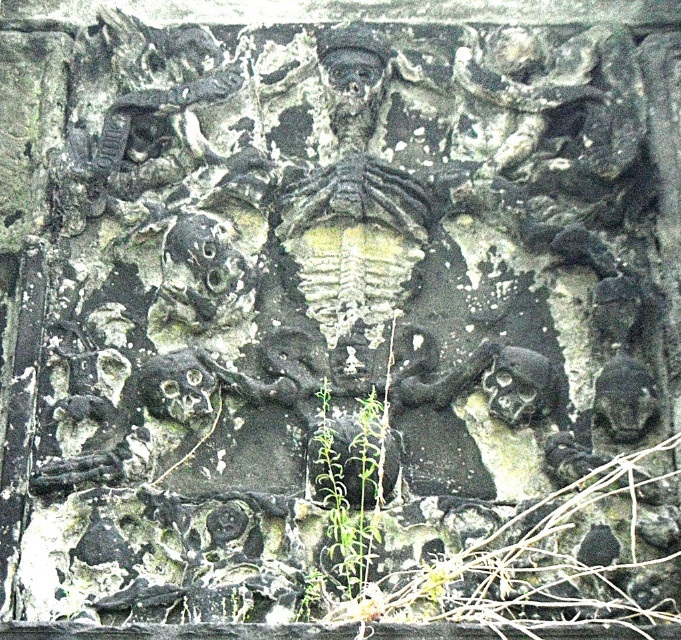
Question: Is green leafy plant at center smaller than dark gray stone skull at lower right?

Choices:
 (A) yes
 (B) no

Answer: (A)

Question: Which object is closer to the camera taking this photo?

Choices:
 (A) green leafy plant at center
 (B) dark gray stone skull at lower right

Answer: (A)

Question: Among these objects, which one is farthest from the camera?

Choices:
 (A) dark gray stone skull at lower right
 (B) green leafy plant at center

Answer: (A)

Question: Does green leafy plant at center appear over dark gray stone skull at lower right?

Choices:
 (A) yes
 (B) no

Answer: (B)

Question: From the image, what is the correct spatial relationship of green leafy plant at center in relation to dark gray stone skull at lower right?

Choices:
 (A) above
 (B) below

Answer: (B)